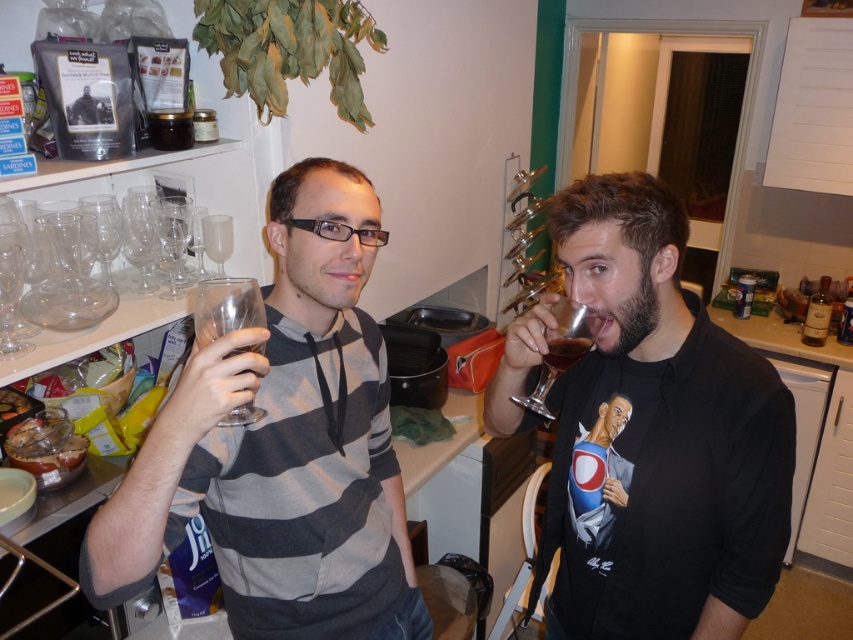
Does dark brown glass jar at upper center appear over translucent glass at right?

Indeed, dark brown glass jar at upper center is positioned over translucent glass at right.

Who is more distant from viewer, (167,131) or (570,342)?

The point (167,131) is more distant.

Who is more forward, (167, 141) or (569, 358)?

Point (569, 358)

Locate an element on the screen. Image resolution: width=853 pixels, height=640 pixels. dark brown glass jar at upper center is located at coordinates (170, 129).

Does transparent glass wine glass at left have a lesser width compared to translucent glass wine glass at right?

Incorrect, transparent glass wine glass at left's width is not less than translucent glass wine glass at right's.

Who is more forward, (35, 317) or (564, 337)?

Positioned in front is point (564, 337).

Is point (61, 248) farther from viewer compared to point (577, 337)?

That is True.

Identify the location of transparent glass wine glass at left. The width and height of the screenshot is (853, 640). (85, 262).

Measure the distance between point [85,237] and camera.

4.89 feet

Where is `transparent glass wine glass at left`? transparent glass wine glass at left is located at coordinates (85, 262).

Identify the location of transparent glass wine glass at left. (85, 262).